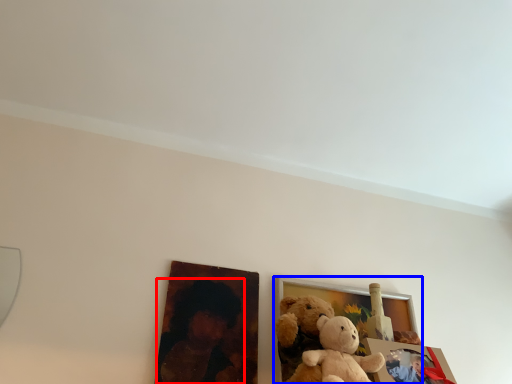
Question: Which of the following is the closest to the observer, person (highlighted by a red box) or picture frame (highlighted by a blue box)?

Choices:
 (A) person
 (B) picture frame

Answer: (A)